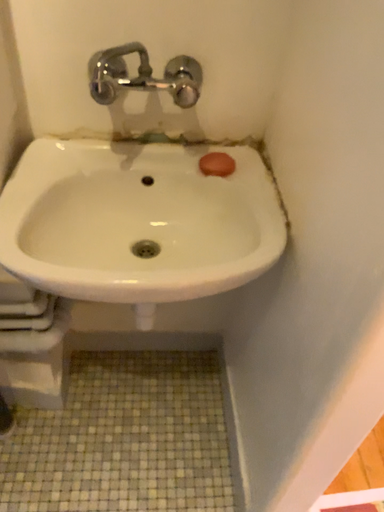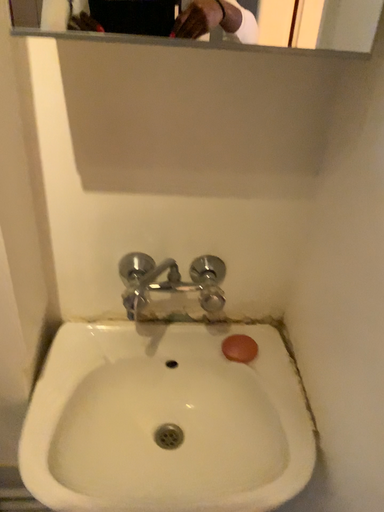
Question: Which way did the camera rotate in the video?

Choices:
 (A) rotated upward
 (B) rotated downward

Answer: (A)